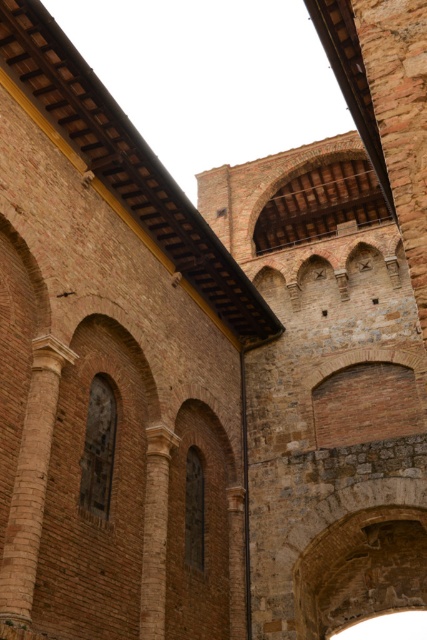
Question: Which object is the closest to the smooth tan stone column at left?

Choices:
 (A) brown stone pillar at center
 (B) brown rough stone pillar at center

Answer: (B)

Question: Which point is closer to the camera taking this photo?

Choices:
 (A) (158, 595)
 (B) (26, 451)
 (C) (242, 513)

Answer: (B)

Question: Is smooth tan stone column at left bigger than brown stone pillar at center?

Choices:
 (A) no
 (B) yes

Answer: (B)

Question: Is brown rough stone pillar at center to the right of brown stone pillar at center from the viewer's perspective?

Choices:
 (A) yes
 (B) no

Answer: (B)

Question: Is brown rough stone pillar at center smaller than brown stone pillar at center?

Choices:
 (A) no
 (B) yes

Answer: (A)

Question: Considering the real-world distances, which object is closest to the brown rough stone pillar at center?

Choices:
 (A) brown stone pillar at center
 (B) smooth tan stone column at left

Answer: (B)